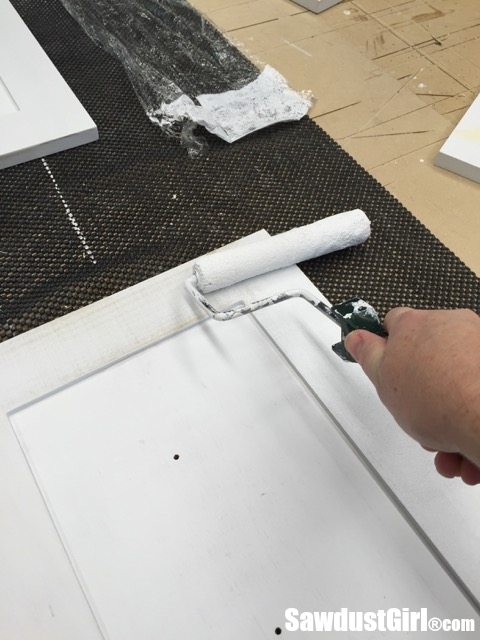
I want to click on handle, so click(x=358, y=321).